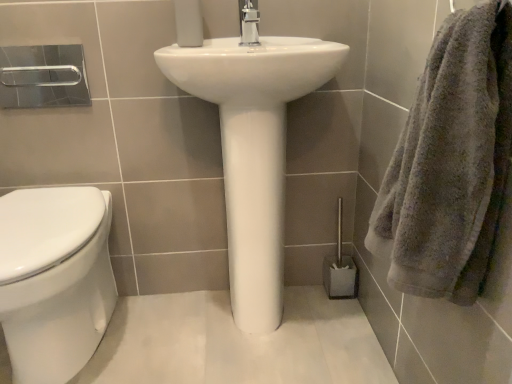
At what (x,y) coordinates should I click in order to perform the action: click on vacant area that lies between white glossy sink at center and gray plastic toilet brush at lower right. Please return your answer as a coordinate pair (x, y). The image size is (512, 384). Looking at the image, I should click on (339, 311).